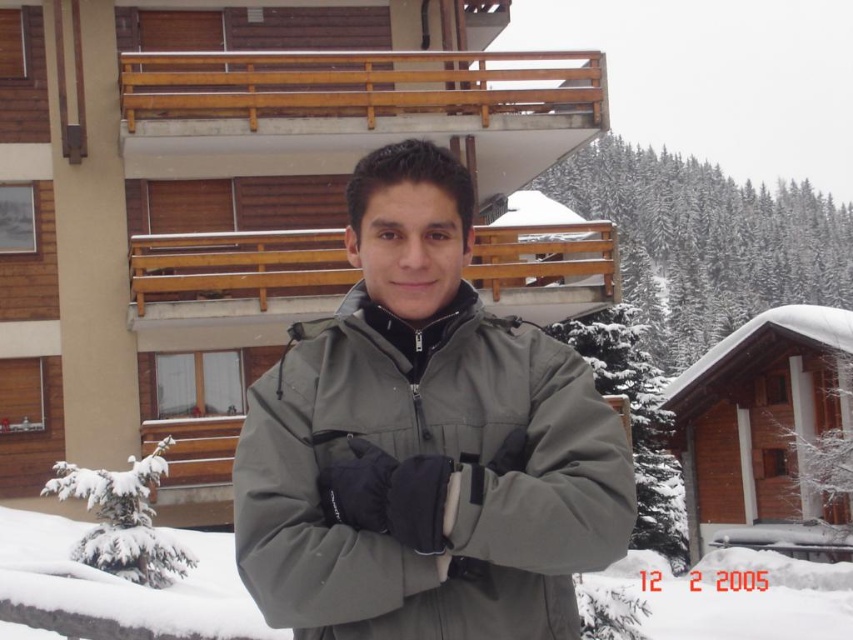
Question: Can you confirm if gray synthetic jacket at center is smaller than white fluffy snow at center?

Choices:
 (A) no
 (B) yes

Answer: (B)

Question: Observing the image, what is the correct spatial positioning of gray synthetic jacket at center in reference to white fluffy snow at center?

Choices:
 (A) below
 (B) above

Answer: (B)

Question: Which point appears closest to the camera in this image?

Choices:
 (A) (782, 588)
 (B) (595, 525)

Answer: (B)

Question: Which of the following is the farthest from the observer?

Choices:
 (A) white fluffy snow at center
 (B) gray synthetic jacket at center

Answer: (A)

Question: Which point appears farthest from the camera in this image?

Choices:
 (A) (596, 554)
 (B) (656, 605)

Answer: (B)

Question: Does gray synthetic jacket at center appear over white fluffy snow at center?

Choices:
 (A) yes
 (B) no

Answer: (A)